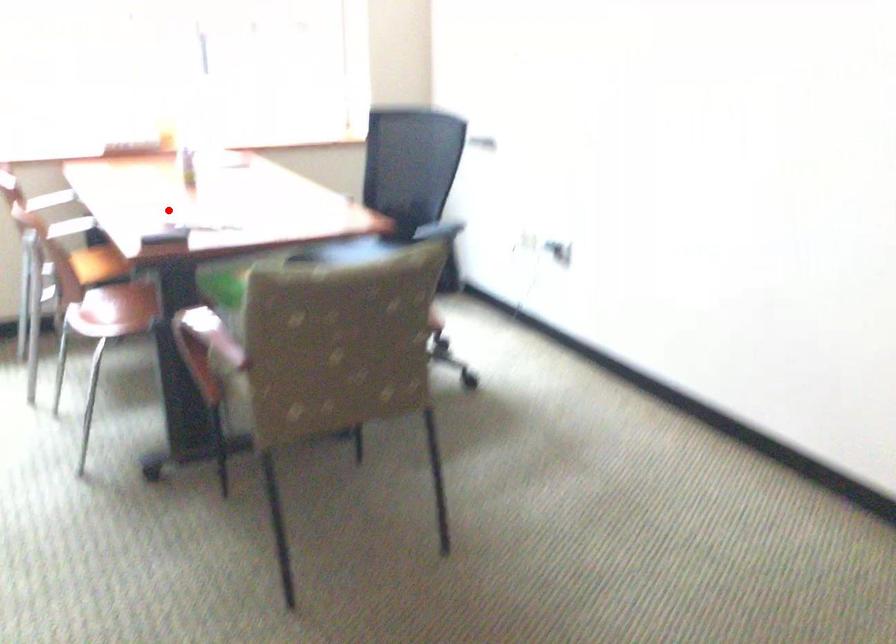
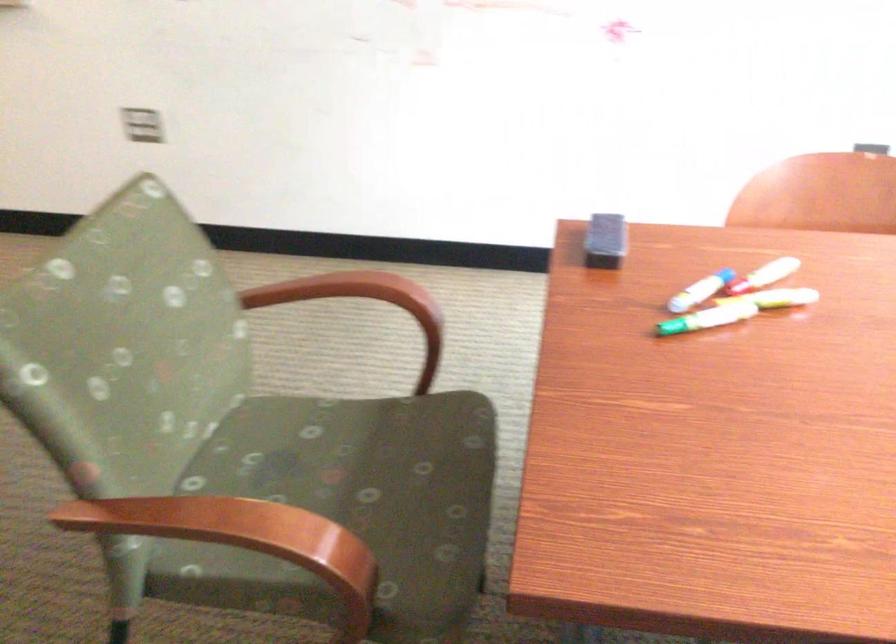
Find the pixel in the second image that matches the highlighted location in the first image.

(773, 270)